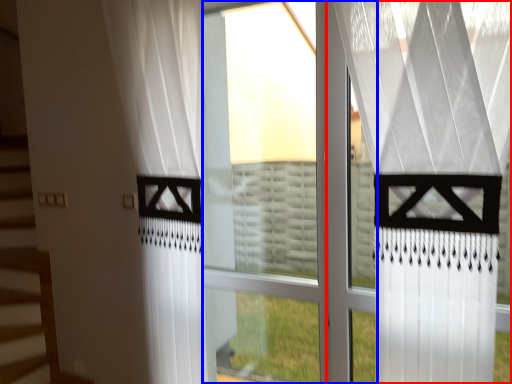
Question: Which of the following is the farthest to the observer, curtain (highlighted by a red box) or glass window (highlighted by a blue box)?

Choices:
 (A) curtain
 (B) glass window

Answer: (B)